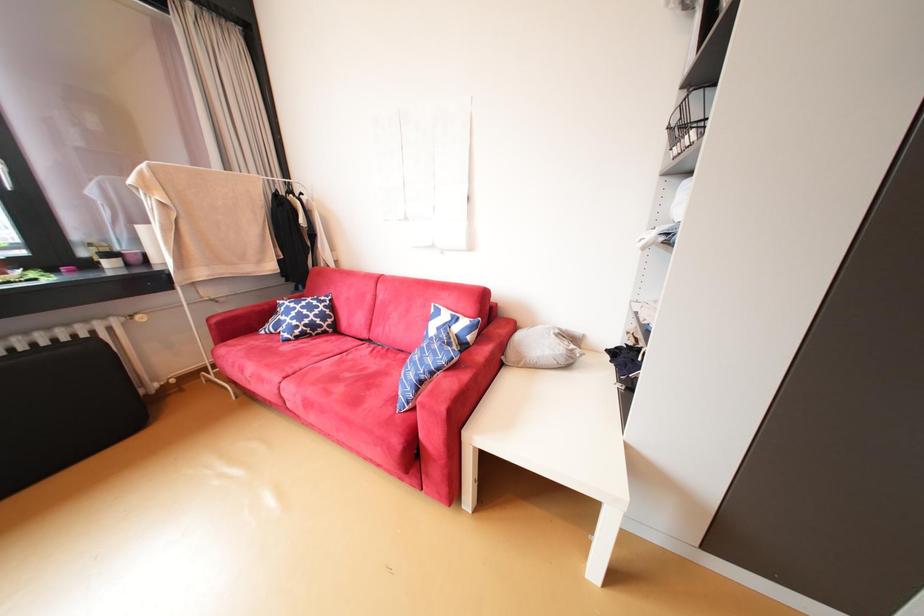
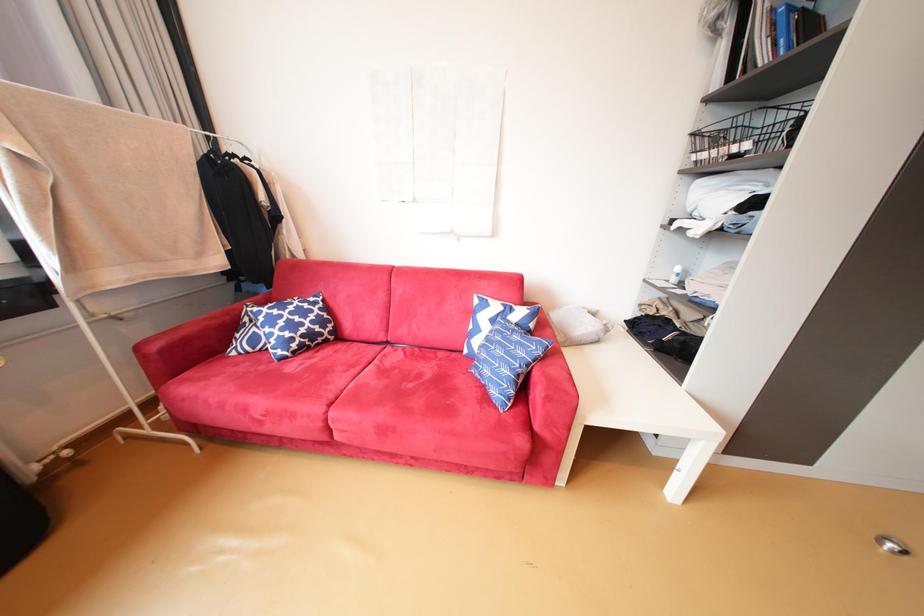
Question: Which direction would the cameraman need to move to produce the second image? Reply with the corresponding letter.

Choices:
 (A) Left
 (B) Right
 (C) Forward
 (D) Backward

Answer: (A)